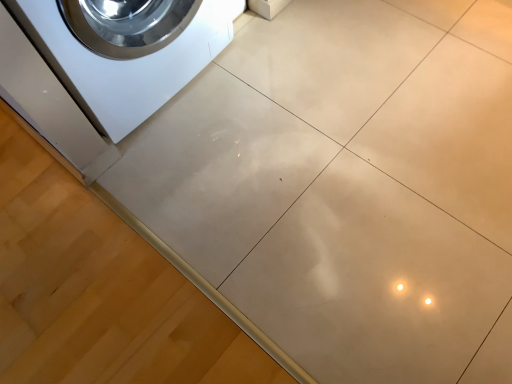
Question: Should I look upward or downward to see white glossy washing machine at upper left?

Choices:
 (A) up
 (B) down

Answer: (A)